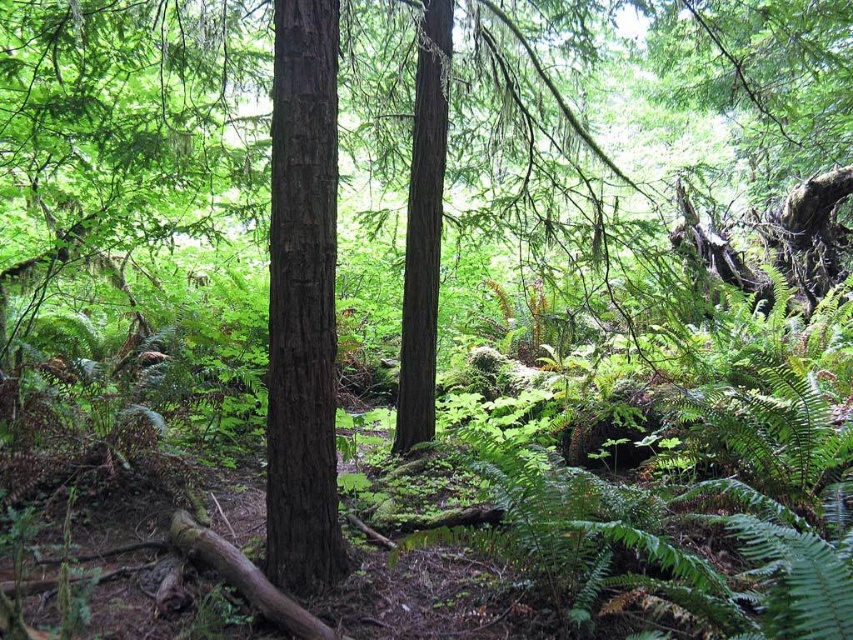
You are a hiker who wants to climb the tallest tree in the forest. You see the dark brown wood tree at center and the smooth brown tree trunk at center. Which tree should you choose to climb?

You should climb the smooth brown tree trunk at center because it is taller than the dark brown wood tree at center according to the description.

You are a hiker with a 2.5 meter long ladder. You need to reach a beehive located on the dark brown wood tree at center. Can you safely place your ladder against the tree from your current position?

The distance between you and the dark brown wood tree at center is 3.04 meters. Since your ladder is only 2.5 meters long, it won t reach the tree. You need a longer ladder or move closer to the tree to safely place it.